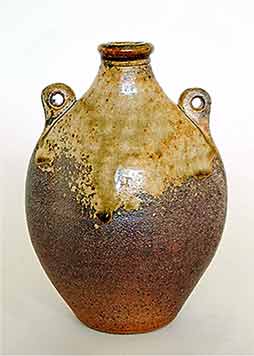
The width and height of the screenshot is (254, 356). Find the location of `the right handle`. the right handle is located at coordinates 201,110.